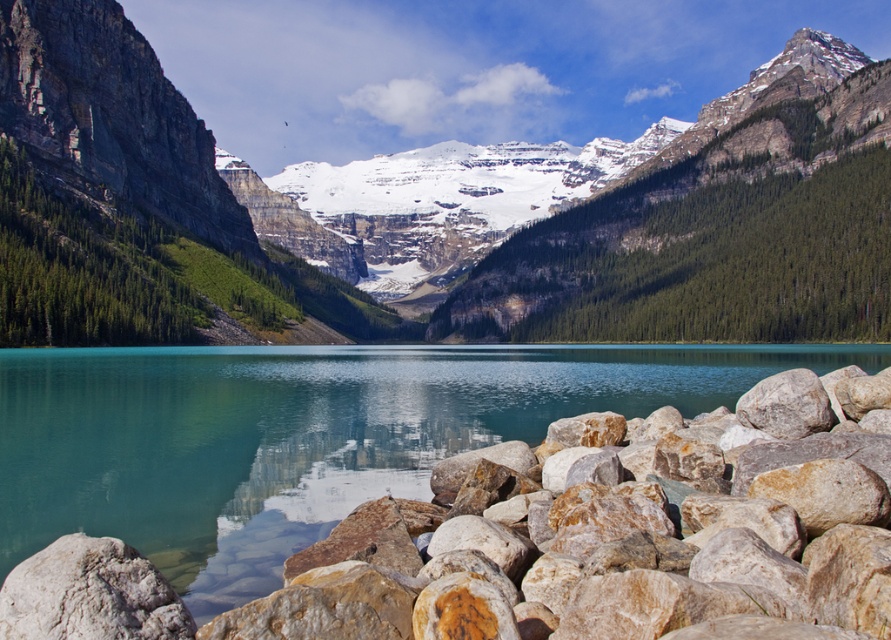
You are planning to take a photo of the snowy rocky mountain at center and the rusty rock at lower right. Which object should you focus on first if you want to capture both in one frame without moving the camera?

You should focus on the snowy rocky mountain at center first because it is bigger than the rusty rock at lower right, so it will require more attention in the composition.

You are standing at the edge of the lake and see the snowy rocky mountain at center and the rusty rock at lower right. Which object is positioned to the right side from your viewpoint?

The snowy rocky mountain at center is to the right of the rusty rock at lower right from your viewpoint.